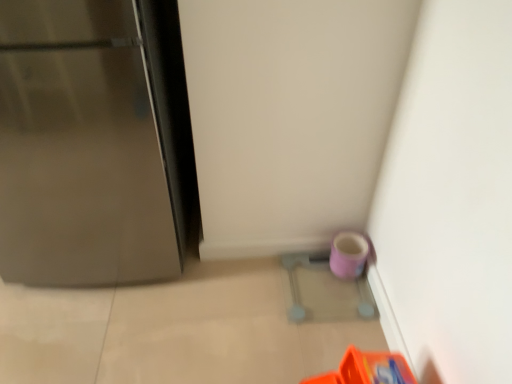
Where is `free spot below satin metallic door at left (from a real-world perspective)`? This screenshot has height=384, width=512. free spot below satin metallic door at left (from a real-world perspective) is located at coordinates (88, 249).